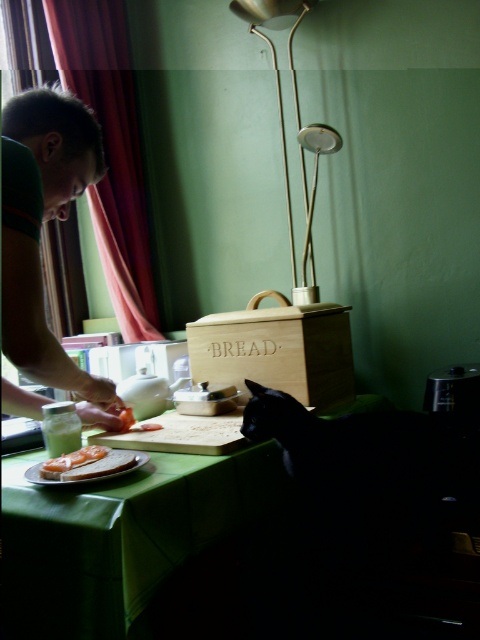
Question: Which of the following is the closest to the observer?

Choices:
 (A) gold metallic lamp at upper center
 (B) green fabric table at lower center
 (C) curtain at left

Answer: (B)

Question: From the image, what is the correct spatial relationship of green shirt at left in relation to slightly toasted bread at center?

Choices:
 (A) left
 (B) right

Answer: (A)

Question: Can you confirm if green shirt at left is positioned to the right of curtain at left?

Choices:
 (A) yes
 (B) no

Answer: (A)

Question: Among these points, which one is farthest from the camera?

Choices:
 (A) (72, 470)
 (B) (23, 360)
 (C) (129, 497)
 (D) (116, 116)

Answer: (D)

Question: Which object is positioned closest to the curtain at left?

Choices:
 (A) gold metallic lamp at upper center
 (B) slightly toasted bread at center
 (C) green fabric table at lower center
 (D) green shirt at left

Answer: (A)

Question: Is green shirt at left above gold metallic lamp at upper center?

Choices:
 (A) yes
 (B) no

Answer: (B)